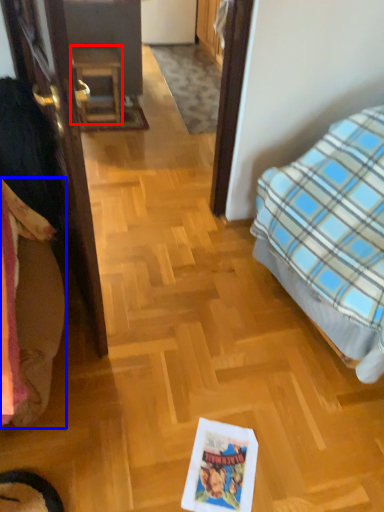
Question: Which object is further to the camera taking this photo, furniture (highlighted by a red box) or bedding (highlighted by a blue box)?

Choices:
 (A) furniture
 (B) bedding

Answer: (A)